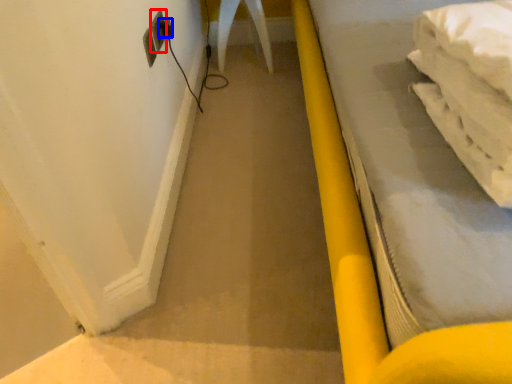
Question: Among these objects, which one is nearest to the camera, electric outlet (highlighted by a red box) or plug (highlighted by a blue box)?

Choices:
 (A) electric outlet
 (B) plug

Answer: (A)